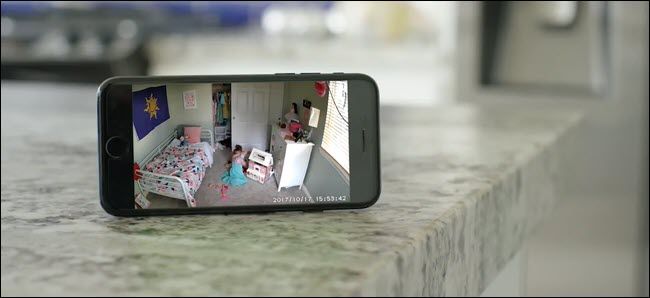
Where is `phone`? This screenshot has height=298, width=650. phone is located at coordinates (369, 130).